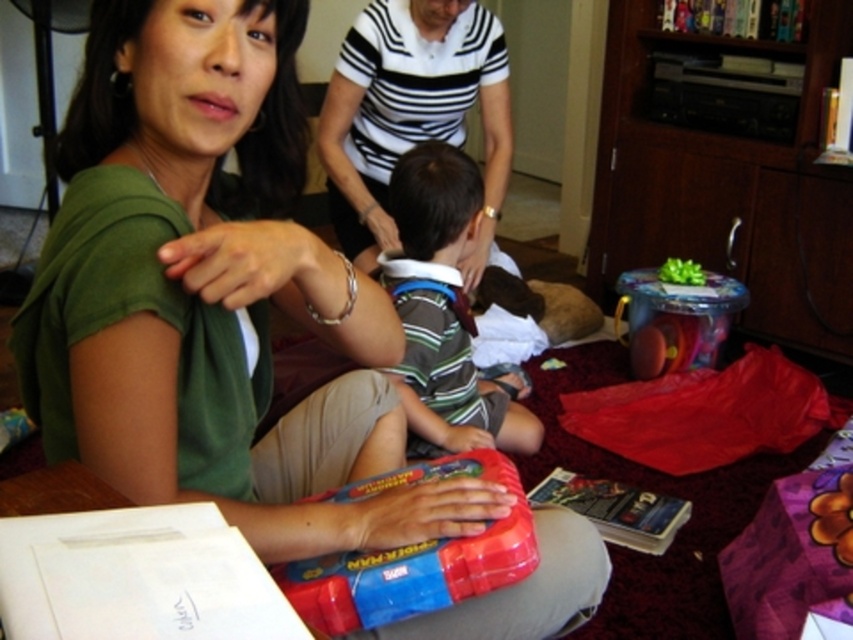
You are a guest at a party and see two shirts in the center of the image. The green matte shirt at center and the striped fabric shirt at center. Which one is positioned to the left?

The green matte shirt at center is to the left of the striped fabric shirt at center, so the green matte shirt at center is positioned to the left.

You are organizing a gift exchange and need to place a new gift box between the striped fabric shirt at center and the purple gift bag. Based on their positions, where should you position the new gift box?

The striped fabric shirt at center is located at point (444, 312), so the new gift box should be placed between these coordinates and the position of the purple gift bag.